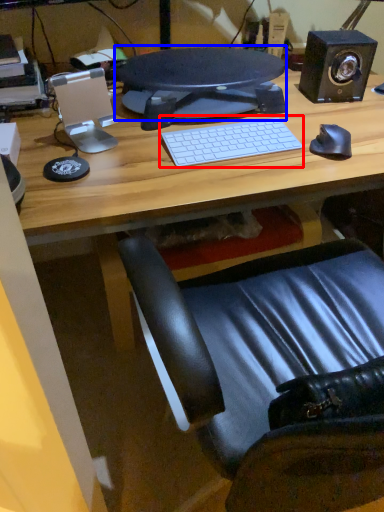
Question: Which point is closer to the camera, computer keyboard (highlighted by a red box) or computer monitor (highlighted by a blue box)?

Choices:
 (A) computer keyboard
 (B) computer monitor

Answer: (A)